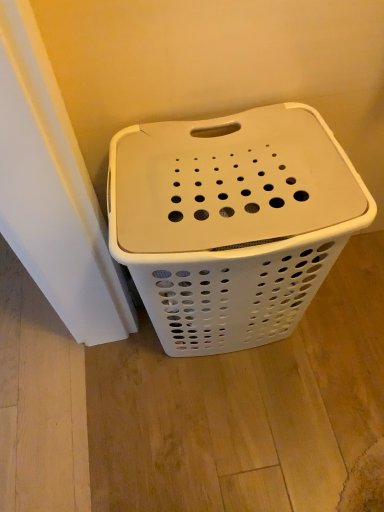
At what (x,y) coordinates should I click in order to perform the action: click on vacant region above white plastic laundry basket at center (from a real-world perspective). Please return your answer as a coordinate pair (x, y). Looking at the image, I should click on (252, 160).